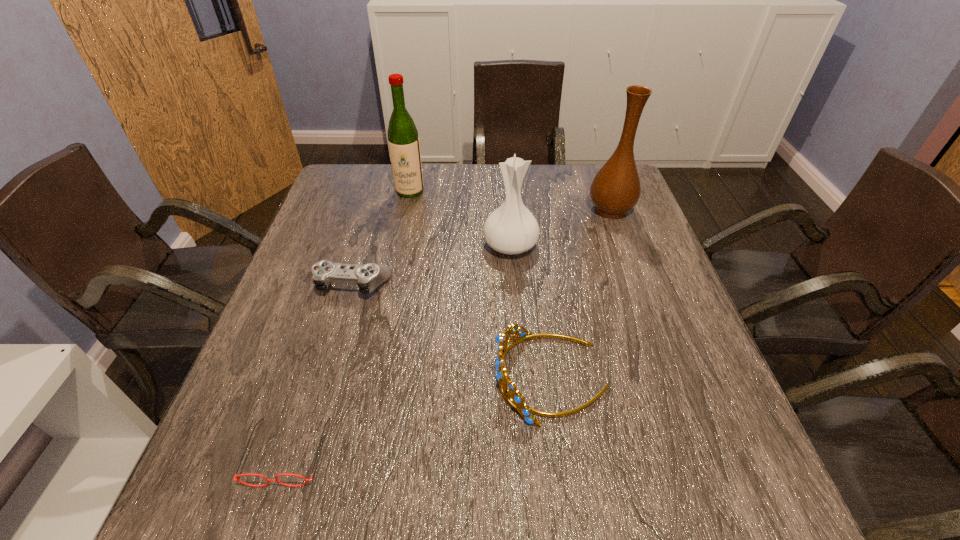
In order to click on free spot that satisfies the following two spatial constraints: 1. on the label of the right vase; 2. on the right side of the liquor in this screenshot , I will do `click(406, 210)`.

Locate an element on the screen. free space that satisfies the following two spatial constraints: 1. on the front-facing side of the fourth tallest object; 2. on the front-facing side of the shortest object is located at coordinates (561, 451).